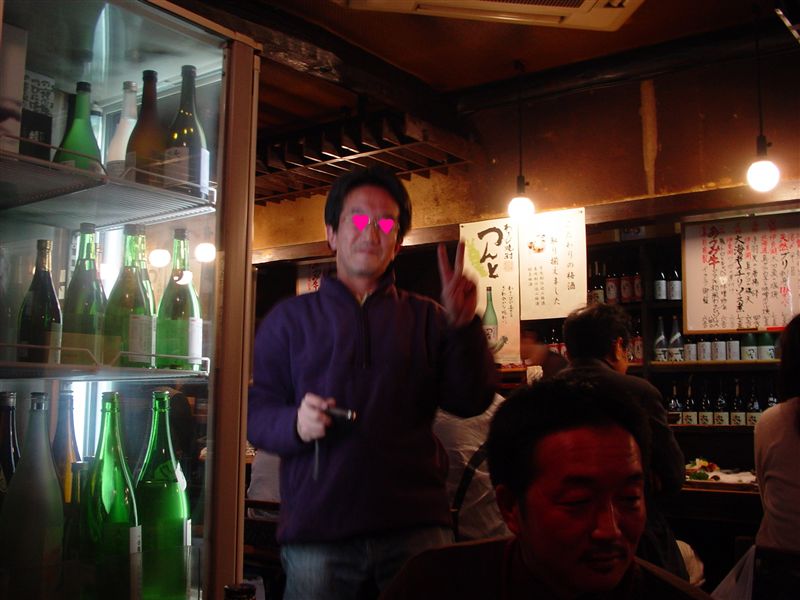
Where is `ceiling`? ceiling is located at coordinates (422, 80).